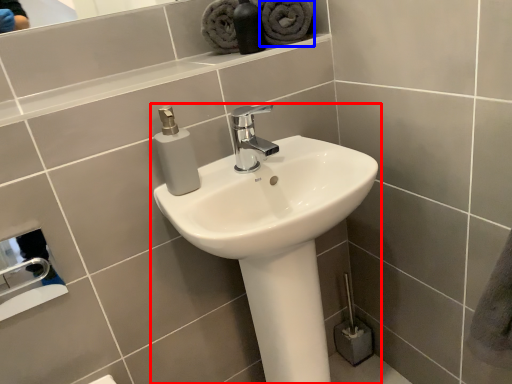
Question: Which point is further to the camera, sink (highlighted by a red box) or bath towel (highlighted by a blue box)?

Choices:
 (A) sink
 (B) bath towel

Answer: (B)